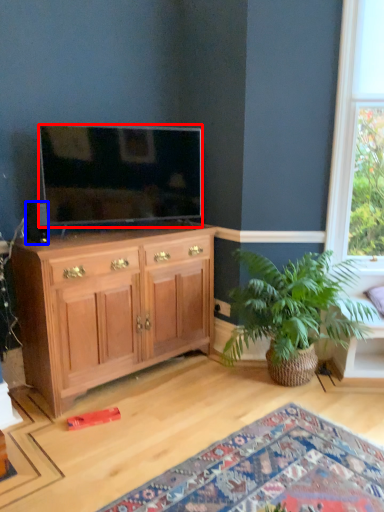
Question: Which object appears closest to the camera in this image, television (highlighted by a red box) or loudspeaker (highlighted by a blue box)?

Choices:
 (A) television
 (B) loudspeaker

Answer: (B)